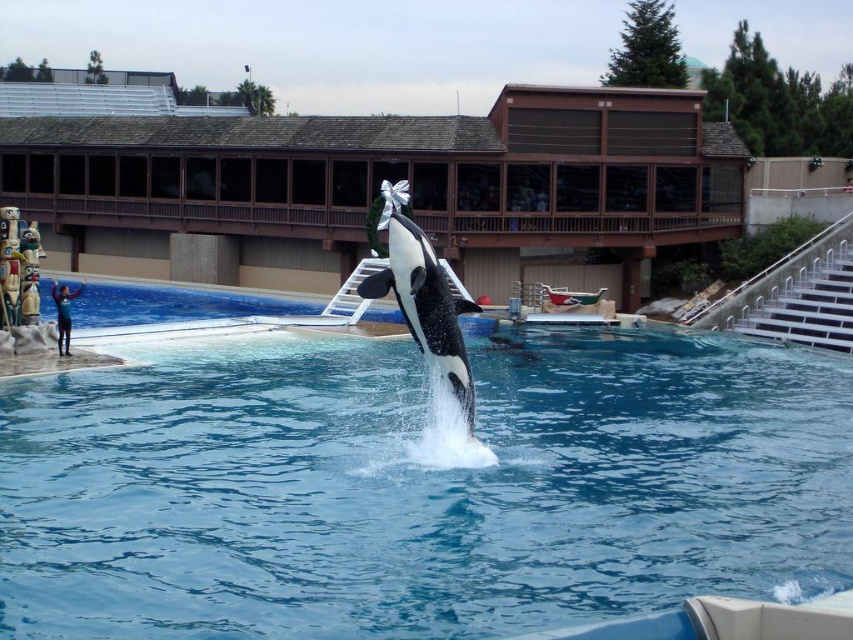
Question: Is blue smooth water at center to the left of black and white dolphin at center from the viewer's perspective?

Choices:
 (A) yes
 (B) no

Answer: (A)

Question: Considering the relative positions of blue smooth water at center and black and white dolphin at center in the image provided, where is blue smooth water at center located with respect to black and white dolphin at center?

Choices:
 (A) above
 (B) below

Answer: (B)

Question: Which point is farther from the camera taking this photo?

Choices:
 (A) (614, 380)
 (B) (433, 310)

Answer: (A)

Question: Is blue smooth water at center to the left of black and white dolphin at center from the viewer's perspective?

Choices:
 (A) yes
 (B) no

Answer: (A)

Question: Which point is closer to the camera taking this photo?

Choices:
 (A) pyautogui.click(x=735, y=410)
 (B) pyautogui.click(x=454, y=387)

Answer: (B)